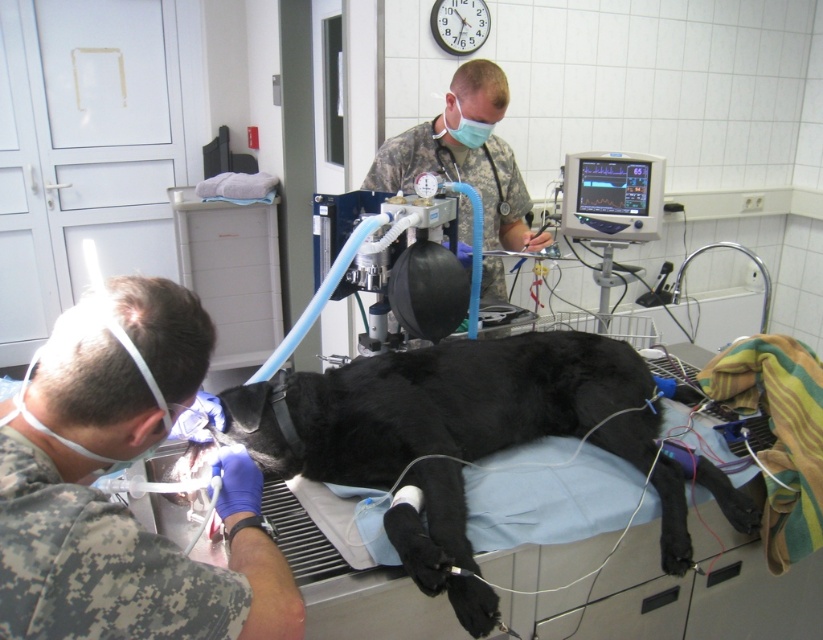
Question: Which point is closer to the camera?

Choices:
 (A) (287, 376)
 (B) (417, 131)

Answer: (A)

Question: Which is farther from the black fur dog at center?

Choices:
 (A) camouflage fabric at left
 (B) camouflage uniform at center
 (C) blue fabric mask at upper center

Answer: (C)

Question: Among these points, which one is nearest to the camera?

Choices:
 (A) [x=477, y=141]
 (B) [x=212, y=634]
 (C) [x=465, y=426]

Answer: (B)

Question: Can you confirm if black fur dog at center is wider than camouflage uniform at center?

Choices:
 (A) yes
 (B) no

Answer: (A)

Question: From the image, what is the correct spatial relationship of camouflage uniform at center in relation to blue fabric mask at upper center?

Choices:
 (A) above
 (B) below

Answer: (B)

Question: Is camouflage uniform at center wider than blue fabric mask at upper center?

Choices:
 (A) no
 (B) yes

Answer: (B)